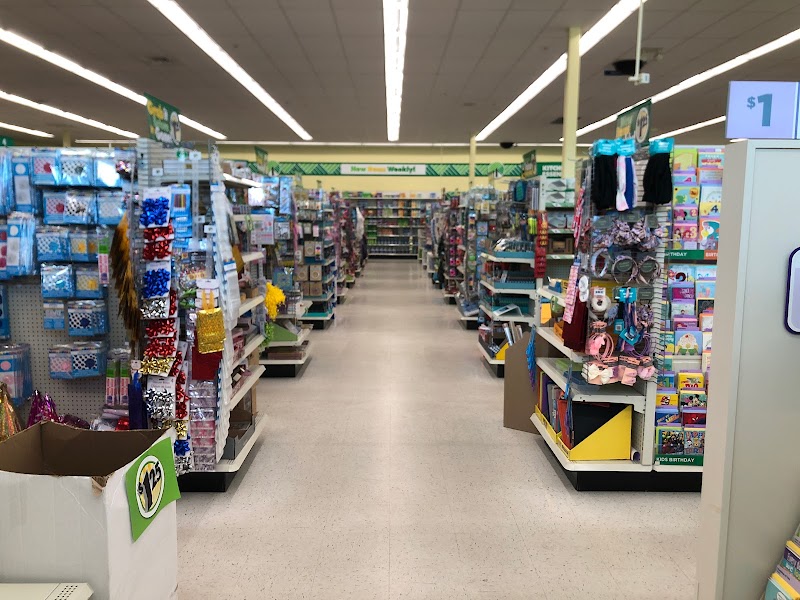
Identify the location of ring binders. This screenshot has width=800, height=600. (573, 413), (558, 420), (549, 406), (538, 388).